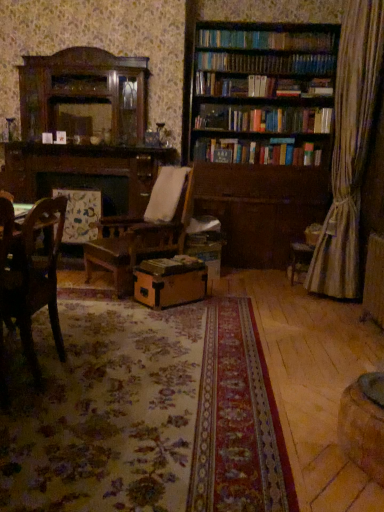
Question: Is brown wooden bookcase at upper right not near wooden chair at left?

Choices:
 (A) no
 (B) yes

Answer: (B)

Question: Considering the relative sizes of brown wooden bookcase at upper right and wooden chair at left in the image provided, is brown wooden bookcase at upper right bigger than wooden chair at left?

Choices:
 (A) no
 (B) yes

Answer: (B)

Question: Does brown wooden bookcase at upper right appear on the left side of wooden chair at left?

Choices:
 (A) no
 (B) yes

Answer: (A)

Question: Is brown wooden bookcase at upper right smaller than wooden chair at left?

Choices:
 (A) yes
 (B) no

Answer: (B)

Question: Is brown wooden bookcase at upper right facing towards wooden chair at left?

Choices:
 (A) yes
 (B) no

Answer: (A)

Question: In terms of size, does wooden chair at left appear bigger or smaller than brown wooden bookcase at upper right?

Choices:
 (A) small
 (B) big

Answer: (A)

Question: Is wooden chair at left situated inside brown wooden bookcase at upper right or outside?

Choices:
 (A) outside
 (B) inside

Answer: (A)

Question: From the image's perspective, is wooden chair at left located above or below brown wooden bookcase at upper right?

Choices:
 (A) below
 (B) above

Answer: (A)

Question: Considering the positions of wooden chair at left and brown wooden bookcase at upper right in the image, is wooden chair at left wider or thinner than brown wooden bookcase at upper right?

Choices:
 (A) wide
 (B) thin

Answer: (B)

Question: In the image, is brown cardboard box at center positioned in front of or behind wooden chair at left?

Choices:
 (A) behind
 (B) front

Answer: (A)

Question: From a real-world perspective, is brown cardboard box at center above or below wooden chair at left?

Choices:
 (A) above
 (B) below

Answer: (B)

Question: Would you say brown cardboard box at center is to the left or to the right of wooden chair at left in the picture?

Choices:
 (A) left
 (B) right

Answer: (B)

Question: Considering the positions of brown cardboard box at center and wooden chair at left in the image, is brown cardboard box at center taller or shorter than wooden chair at left?

Choices:
 (A) short
 (B) tall

Answer: (A)

Question: Choose the correct answer: Is brown wooden bookcase at upper right inside brown cardboard box at center or outside it?

Choices:
 (A) outside
 (B) inside

Answer: (A)

Question: From their relative heights in the image, would you say brown wooden bookcase at upper right is taller or shorter than brown cardboard box at center?

Choices:
 (A) tall
 (B) short

Answer: (A)